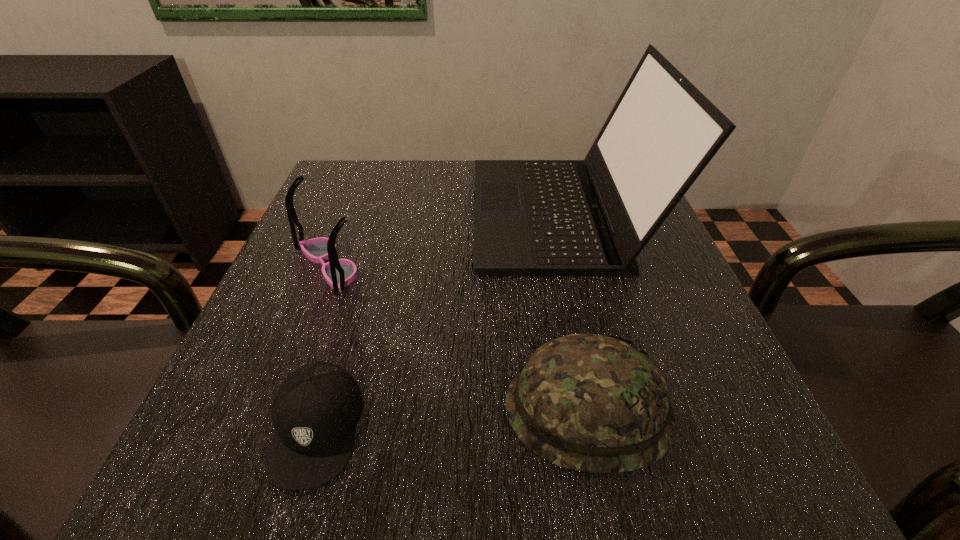
Identify the location of free point between the taller cap and the left cap. Image resolution: width=960 pixels, height=540 pixels. (451, 418).

Locate an element on the screen. The height and width of the screenshot is (540, 960). vacant area that lies between the shortest object and the second tallest object is located at coordinates point(322,346).

The height and width of the screenshot is (540, 960). What are the coordinates of `free space between the laptop and the taller cap` in the screenshot? It's located at (574, 311).

This screenshot has width=960, height=540. What are the coordinates of `vacant point located between the laptop and the shortest object` in the screenshot? It's located at point(439,320).

I want to click on free space between the left cap and the right cap, so click(x=451, y=418).

Point out which object is positioned as the third nearest to the left cap. Please provide its 2D coordinates. Your answer should be formatted as a tuple, i.e. [(x, y)], where the tuple contains the x and y coordinates of a point satisfying the conditions above.

[(592, 217)]

Locate which object is the third closest to the shorter cap. Please provide its 2D coordinates. Your answer should be formatted as a tuple, i.e. [(x, y)], where the tuple contains the x and y coordinates of a point satisfying the conditions above.

[(592, 217)]

In order to click on vacant area in the image that satisfies the following two spatial constraints: 1. on the surface of the laptop; 2. on the front-facing side of the shorter cap in this screenshot , I will do `click(612, 428)`.